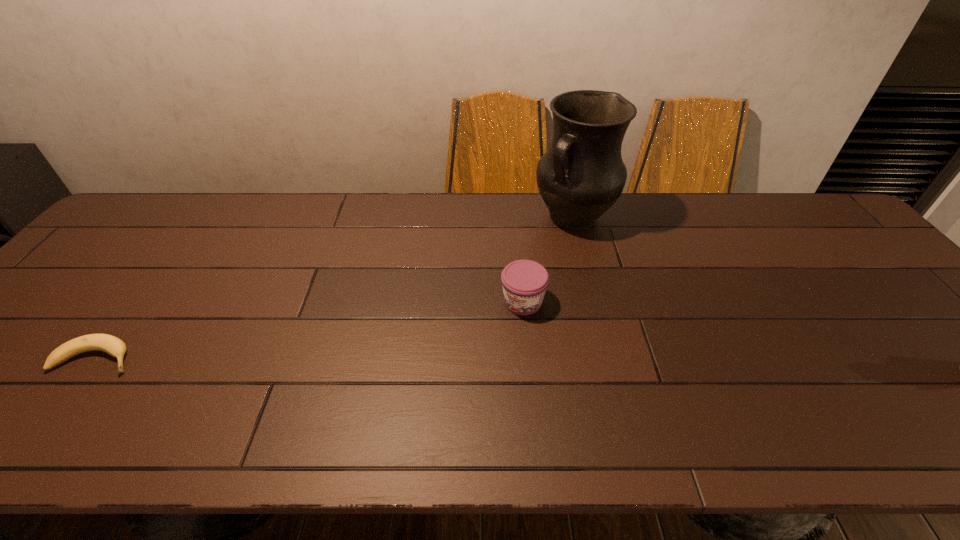
Locate an element on the screen. This screenshot has height=540, width=960. the shortest object is located at coordinates (112, 345).

The image size is (960, 540). Identify the location of the leftmost object. (112, 345).

You are a GUI agent. You are given a task and a screenshot of the screen. Output one action in this format:
    pyautogui.click(x=<x>, y=<y>)
    Task: Click on the pitcher
    The image size is (960, 540).
    Given the screenshot: What is the action you would take?
    pyautogui.click(x=582, y=174)

Identify the location of the tallest object. (582, 174).

Image resolution: width=960 pixels, height=540 pixels. In order to click on the second shortest object in this screenshot , I will do `click(524, 282)`.

Find the location of `the second farthest object`. the second farthest object is located at coordinates (524, 282).

Locate an element on the screen. This screenshot has height=540, width=960. vacant region located at the stem of the nearest object is located at coordinates (171, 359).

Where is `blank area located on the handle side of the tallest object`? This screenshot has height=540, width=960. blank area located on the handle side of the tallest object is located at coordinates (492, 288).

The image size is (960, 540). I want to click on vacant space positioned on the handle side of the tallest object, so click(x=513, y=271).

The height and width of the screenshot is (540, 960). Identify the location of free space located on the handle side of the tallest object. tap(487, 293).